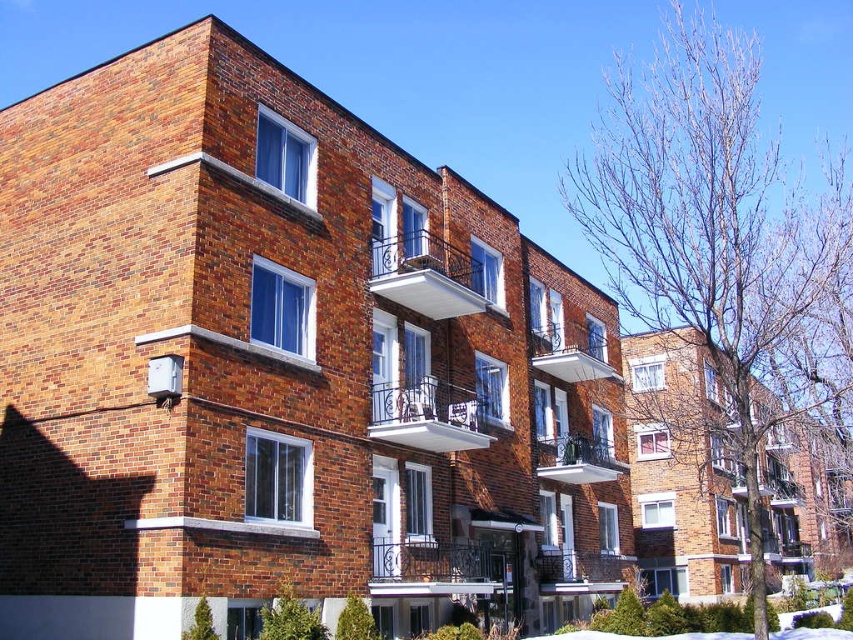
Question: Can you confirm if smooth metal balcony at center is positioned above white matte balcony at upper center?

Choices:
 (A) yes
 (B) no

Answer: (B)

Question: Is rustic wrought iron balcony at center below white matte balcony at upper center?

Choices:
 (A) no
 (B) yes

Answer: (B)

Question: Which point is farther from the camera taking this photo?

Choices:
 (A) (392, 545)
 (B) (576, 472)
 (C) (570, 580)
 (D) (488, 432)

Answer: (B)

Question: Which point is farther to the camera?

Choices:
 (A) white matte balcony at upper center
 (B) metallic silver balcony at center
 (C) white metal balcony at center
 (D) smooth metal balcony at center

Answer: (A)

Question: Which point is closer to the camera taking this photo?

Choices:
 (A) (x=554, y=476)
 (B) (x=486, y=570)
 (C) (x=454, y=296)

Answer: (C)

Question: Is black wrought iron balcony at center wider than smooth metal balcony at center?

Choices:
 (A) yes
 (B) no

Answer: (B)